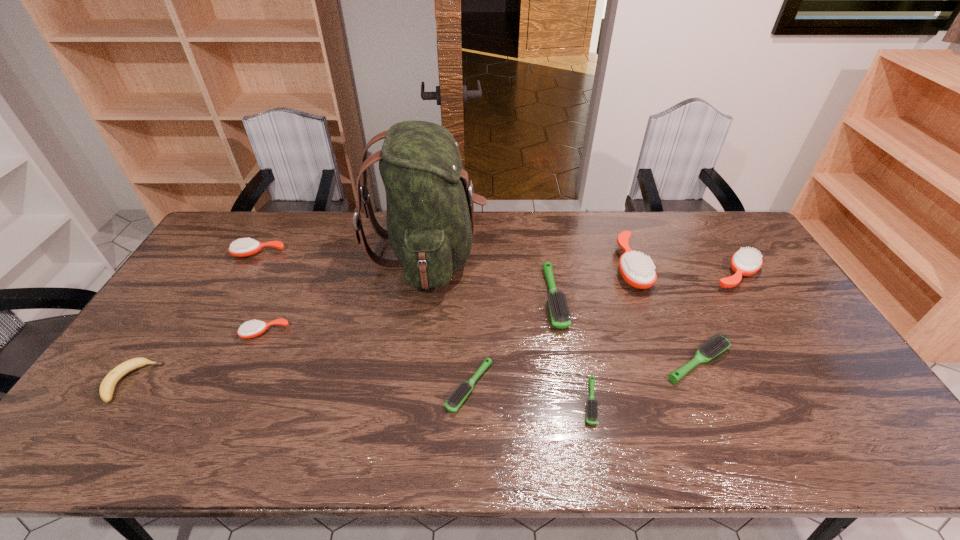
The width and height of the screenshot is (960, 540). I want to click on object present at the far left corner, so click(244, 247).

Identify the location of free spot at the far edge of the desktop. The image size is (960, 540). (633, 224).

The height and width of the screenshot is (540, 960). I want to click on vacant space at the near edge, so click(248, 431).

The image size is (960, 540). I want to click on vacant space at the left edge, so click(x=156, y=316).

The width and height of the screenshot is (960, 540). What are the coordinates of `vacant space at the far left corner of the desktop` in the screenshot? It's located at (251, 219).

The height and width of the screenshot is (540, 960). In order to click on vacant region at the far right corner of the desktop in this screenshot , I will do `click(704, 216)`.

Image resolution: width=960 pixels, height=540 pixels. In the image, there is a desktop. Identify the location of vacant space at the near right corner. (852, 448).

What are the coordinates of `empty location between the banana and the nearest orange hairbrush` in the screenshot? It's located at (199, 357).

This screenshot has width=960, height=540. I want to click on vacant point located between the third smallest orange hairbrush and the backpack, so click(581, 265).

Image resolution: width=960 pixels, height=540 pixels. In order to click on blank region between the green backpack and the leftmost light hairbrush in this screenshot , I will do `click(448, 320)`.